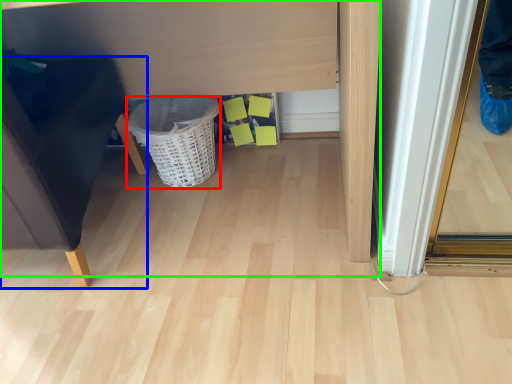
Question: Which object is positioned closest to basket (highlighted by a red box)? Select from furniture (highlighted by a blue box) and vanity (highlighted by a green box).

Choices:
 (A) furniture
 (B) vanity

Answer: (B)